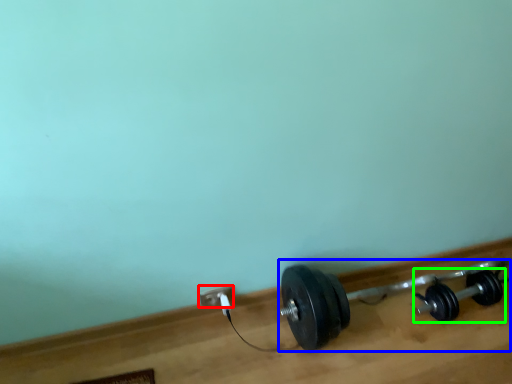
Question: Which object is the closest to the power plugs and sockets (highlighted by a red box)? Choose among these: dumbbell (highlighted by a blue box) or dumbbell (highlighted by a green box).

Choices:
 (A) dumbbell
 (B) dumbbell

Answer: (A)